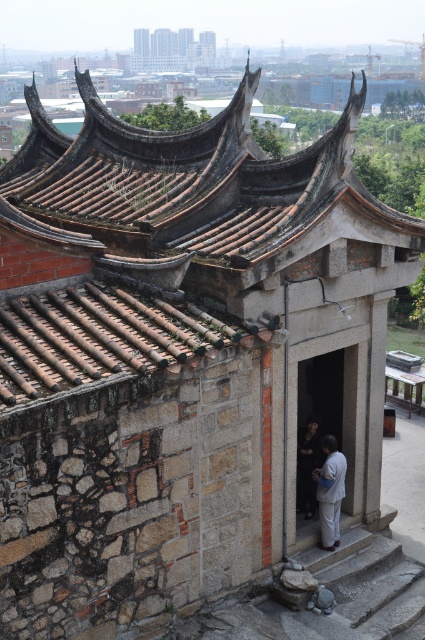
Question: Does brown tiled roof at upper center lie behind dark gray fabric pants at center?

Choices:
 (A) no
 (B) yes

Answer: (A)

Question: Does brown tiled roof at upper center appear under brown stone temple at upper center?

Choices:
 (A) yes
 (B) no

Answer: (A)

Question: Which object is farther from the camera taking this photo?

Choices:
 (A) dark gray fabric pants at center
 (B) brown stone temple at upper center

Answer: (B)

Question: Which object is farther from the camera taking this photo?

Choices:
 (A) brown stone temple at upper center
 (B) dark gray fabric pants at center

Answer: (A)

Question: Is dark gray fabric pants at center to the right of dark gray fabric at center from the viewer's perspective?

Choices:
 (A) yes
 (B) no

Answer: (A)

Question: Which object is the closest to the brown tiled roof at upper center?

Choices:
 (A) dark gray fabric pants at center
 (B) dark gray fabric at center

Answer: (A)